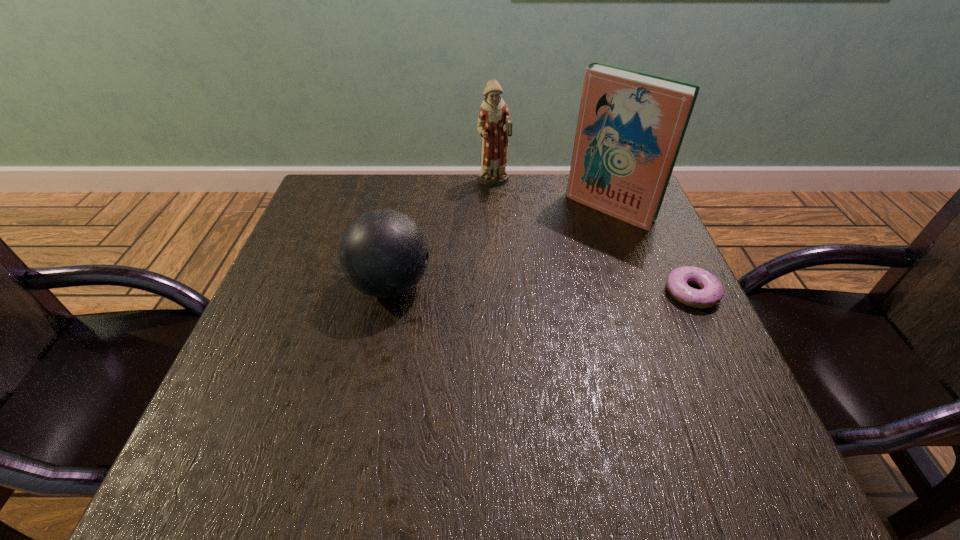
Find the location of a particular element. free space on the desktop that is between the third tallest object and the doughnut and is positioned on the cover of the tallest object is located at coordinates (530, 288).

You are a GUI agent. You are given a task and a screenshot of the screen. Output one action in this format:
    pyautogui.click(x=<x>, y=<y>)
    Task: Click on the free spot on the desktop that is between the bowling ball and the shortest object and is positioned on the front-facing side of the third object from right to left
    The width and height of the screenshot is (960, 540).
    Given the screenshot: What is the action you would take?
    pyautogui.click(x=543, y=289)